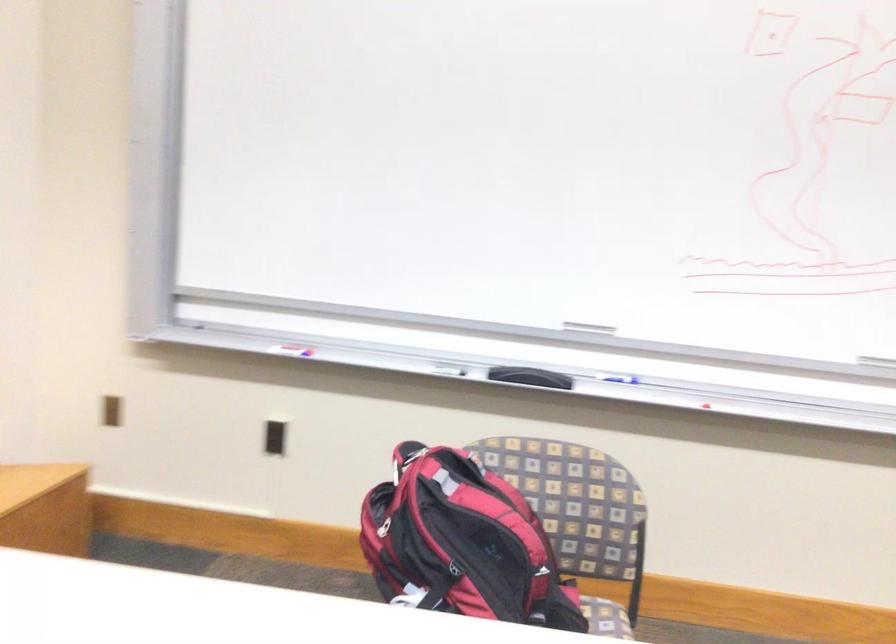
Where is `red and black backpack`? This screenshot has width=896, height=644. red and black backpack is located at coordinates (478, 542).